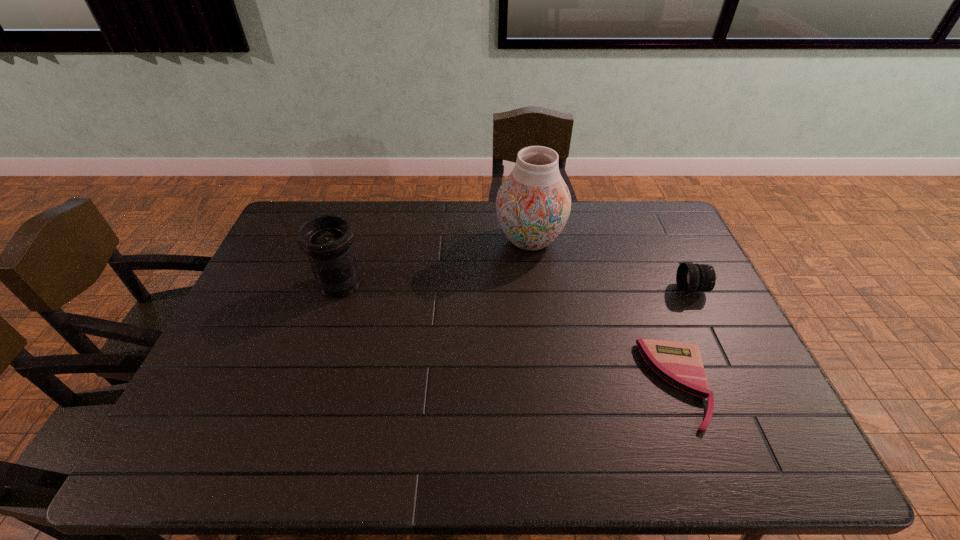
Image resolution: width=960 pixels, height=540 pixels. Identify the location of vacant space in between the shortest object and the shorter telephoto lens. (685, 337).

The height and width of the screenshot is (540, 960). I want to click on empty space that is in between the tallest object and the third shortest object, so click(x=435, y=262).

The width and height of the screenshot is (960, 540). I want to click on blank region between the shorter telephoto lens and the shortest object, so click(685, 337).

Where is `empty location between the left telephoto lens and the second shortest object`? The height and width of the screenshot is (540, 960). empty location between the left telephoto lens and the second shortest object is located at coordinates (516, 287).

At what (x,y) coordinates should I click in order to perform the action: click on free space between the left telephoto lens and the vase. Please return your answer as a coordinate pair (x, y). Looking at the image, I should click on (435, 262).

Image resolution: width=960 pixels, height=540 pixels. In order to click on object that is the second closest one to the third object from left to right in this screenshot , I will do `click(533, 204)`.

Select which object appears as the third closest to the nearest object. Please provide its 2D coordinates. Your answer should be formatted as a tuple, i.e. [(x, y)], where the tuple contains the x and y coordinates of a point satisfying the conditions above.

[(327, 239)]

The image size is (960, 540). I want to click on free location that satisfies the following two spatial constraints: 1. on the front side of the vase; 2. on the left side of the nearest object, so click(548, 384).